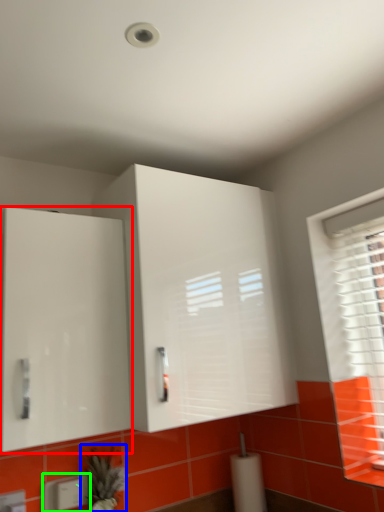
Question: Which object is the closest to the cabinetry (highlighted by a red box)? Choose among these: plant (highlighted by a blue box) or electric outlet (highlighted by a green box).

Choices:
 (A) plant
 (B) electric outlet

Answer: (A)